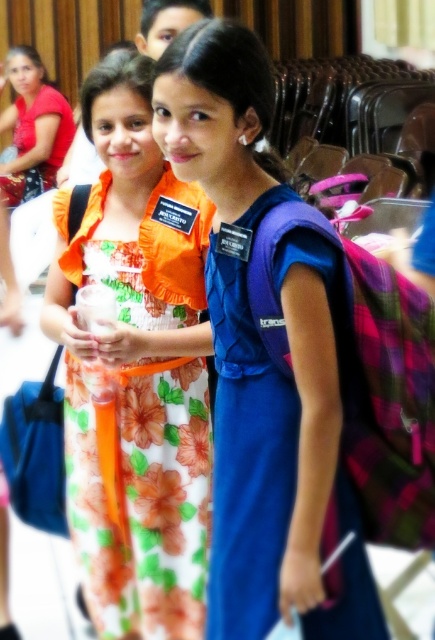
Between floral dress at center and matte red dress at upper left, which one appears on the left side from the viewer's perspective?

From the viewer's perspective, matte red dress at upper left appears more on the left side.

Who is taller, floral dress at center or matte red dress at upper left?

With more height is floral dress at center.

Is point (207, 224) less distant than point (50, 112)?

Yes, it is in front of point (50, 112).

At what (x,y) coordinates should I click in order to perform the action: click on floral dress at center. Please return your answer as a coordinate pair (x, y). The width and height of the screenshot is (435, 640). Looking at the image, I should click on (137, 369).

Is point (378, 620) positioned in front of point (16, 65)?

Yes, it is.

Who is lower down, purple fabric backpack at center or matte red dress at upper left?

purple fabric backpack at center is lower down.

Where is `purple fabric backpack at center`? The height and width of the screenshot is (640, 435). purple fabric backpack at center is located at coordinates (247, 442).

Who is taller, floral dress at center or purple fabric backpack at center?

floral dress at center

Is point (69, 406) farther from viewer compared to point (263, 506)?

Yes, it is.

The height and width of the screenshot is (640, 435). Find the location of `floral dress at center`. floral dress at center is located at coordinates [137, 369].